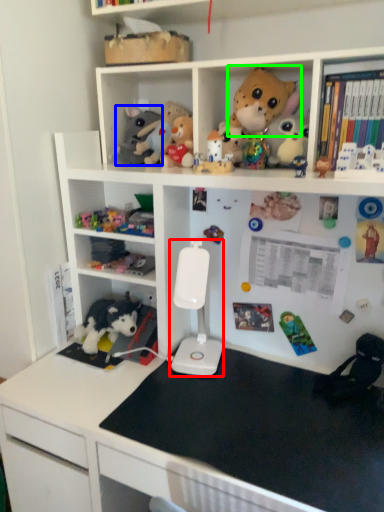
Question: Which object is positioned farthest from equipment (highlighted by a red box)? Select from toy (highlighted by a blue box) and toy (highlighted by a green box).

Choices:
 (A) toy
 (B) toy

Answer: (B)